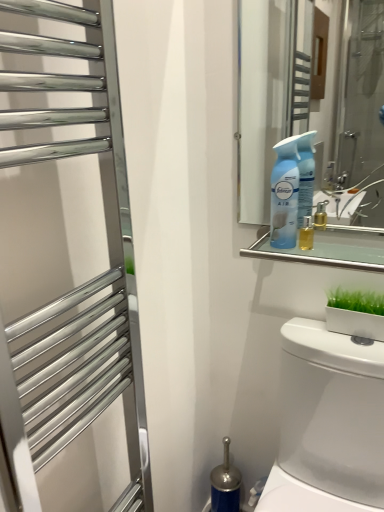
Identify the location of vacant space to the left of green matte planter at lower right. The height and width of the screenshot is (512, 384). pos(324,338).